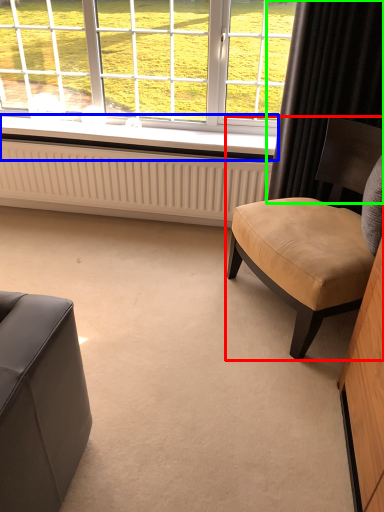
Question: Considering the real-world distances, which object is closest to chair (highlighted by a red box)? window sill (highlighted by a blue box) or curtain (highlighted by a green box).

Choices:
 (A) window sill
 (B) curtain

Answer: (B)